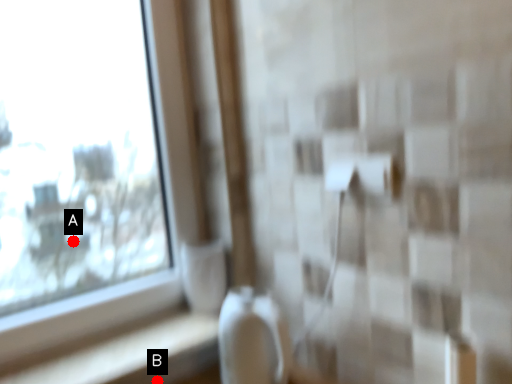
Question: Two points are circled on the image, labeled by A and B beside each circle. Which point is closer to the camera?

Choices:
 (A) A is closer
 (B) B is closer

Answer: (B)